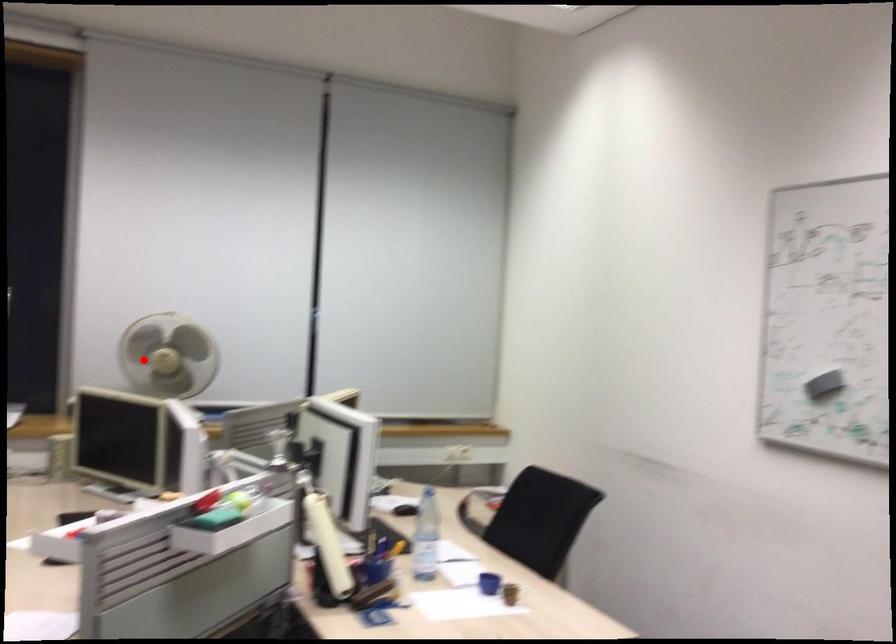
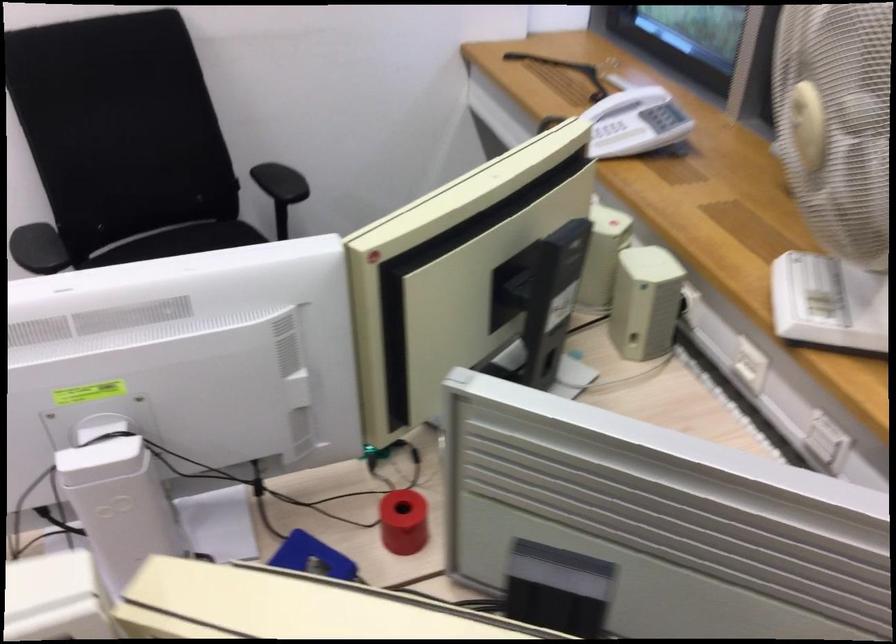
Question: A red point is marked in image1. In image2, is the corresponding 3D point closer to the camera or farther? Reply with the corresponding letter.

Choices:
 (A) The corresponding 3D point is closer.
 (B) The corresponding 3D point is farther.

Answer: (A)